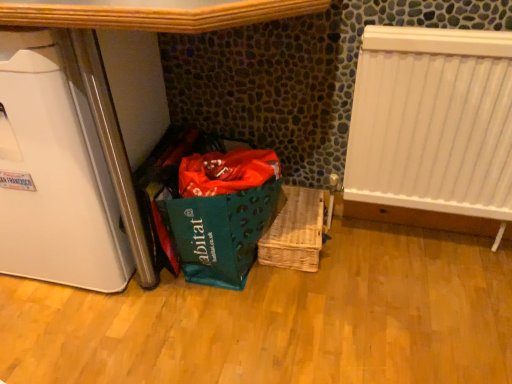
Where is `free space that is to the left of white plastic radiator at right`? The width and height of the screenshot is (512, 384). free space that is to the left of white plastic radiator at right is located at coordinates (338, 271).